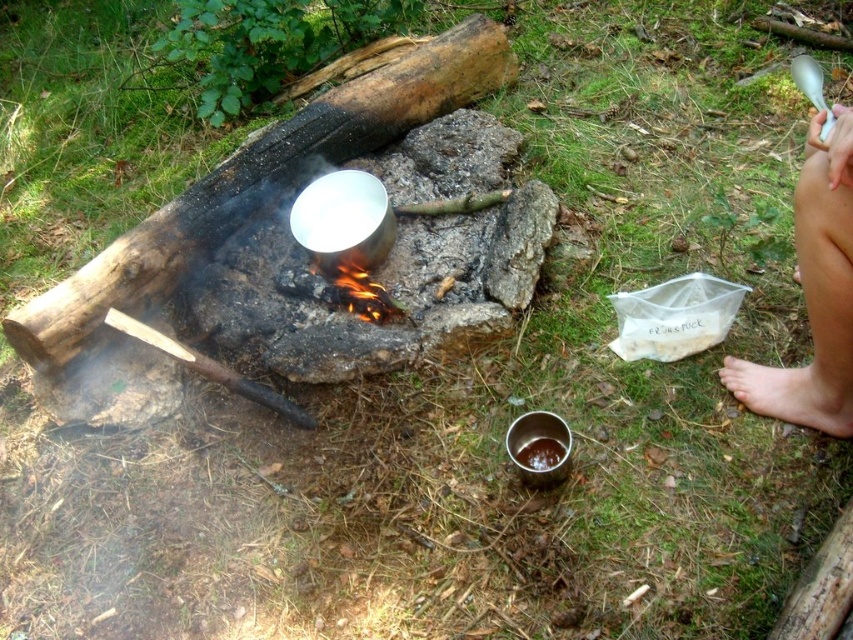
Which of these two, bare skin leg at right or bare skin at lower right, stands taller?

Standing taller between the two is bare skin leg at right.

Who is more forward, (822, 236) or (822, 384)?

Positioned in front is point (822, 236).

Where is `bare skin leg at right`? Image resolution: width=853 pixels, height=640 pixels. bare skin leg at right is located at coordinates (814, 294).